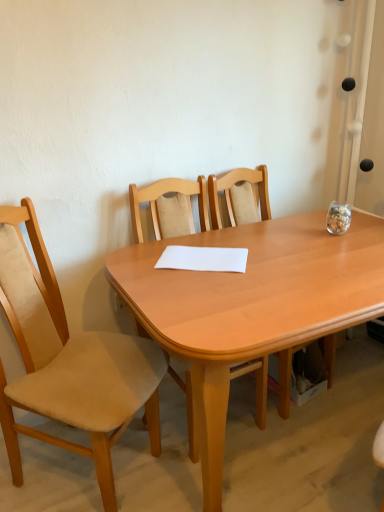
The width and height of the screenshot is (384, 512). I want to click on vacant space underneath light wood table at center (from a real-world perspective), so click(x=312, y=442).